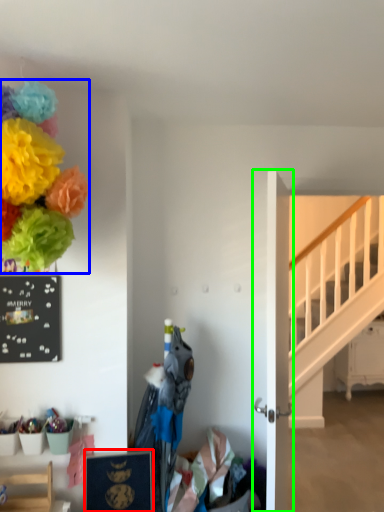
Question: Considering the real-world distances, which object is farthest from picture frame (highlighted by a red box)? flower (highlighted by a blue box) or door (highlighted by a green box)?

Choices:
 (A) flower
 (B) door

Answer: (A)